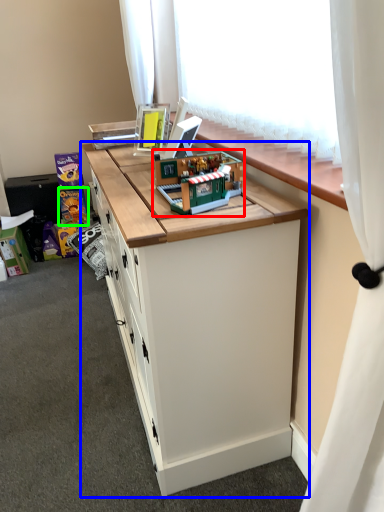
Question: Considering the real-world distances, which object is closest to toy (highlighted by a red box)? cabinetry (highlighted by a blue box) or toy (highlighted by a green box).

Choices:
 (A) cabinetry
 (B) toy

Answer: (A)